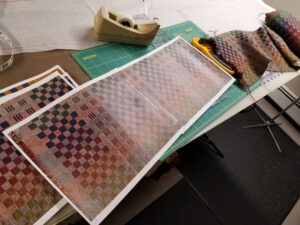
Image resolution: width=300 pixels, height=225 pixels. Identify the location of stand for floor light. (283, 111), (267, 125).